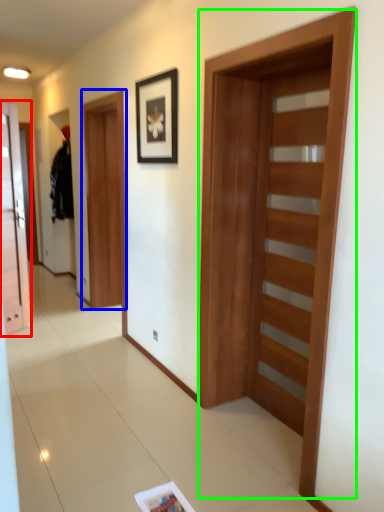
Question: Based on their relative distances, which object is farther from door (highlighted by a red box)? Choose from barn door (highlighted by a blue box) and barn door (highlighted by a green box).

Choices:
 (A) barn door
 (B) barn door

Answer: (B)